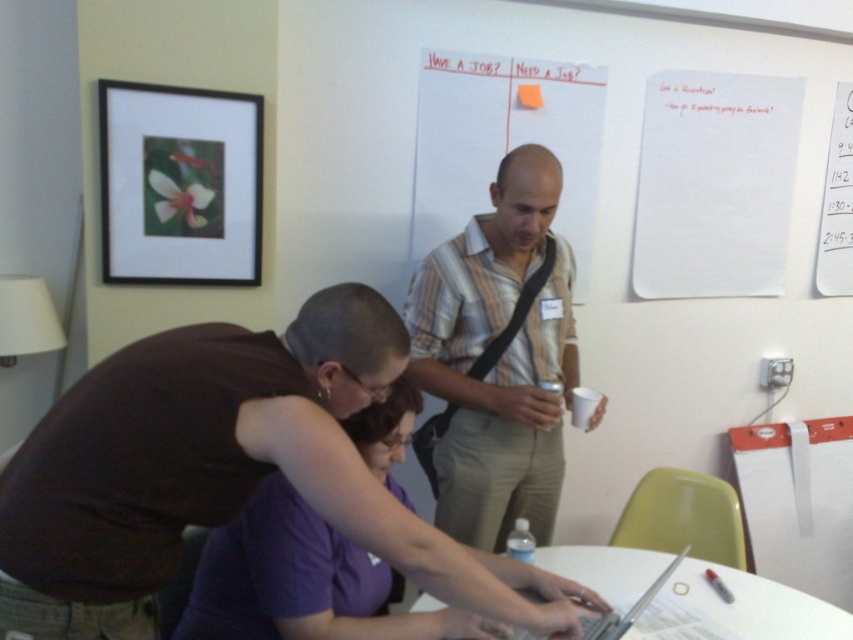
Question: Which of the following is the closest to the observer?

Choices:
 (A) (564, 272)
 (B) (625, 614)
 (C) (170, 106)

Answer: (B)

Question: Among these objects, which one is farthest from the camera?

Choices:
 (A) purple matte shirt at center
 (B) silver metallic laptop at center
 (C) striped cotton shirt at center

Answer: (C)

Question: Does purple matte shirt at center have a smaller size compared to silver metallic laptop at center?

Choices:
 (A) no
 (B) yes

Answer: (A)

Question: Which of the following is the farthest from the observer?

Choices:
 (A) striped cotton shirt at center
 (B) white glossy table at center
 (C) silver metallic laptop at center

Answer: (A)

Question: Can you confirm if striped cotton shirt at center is positioned to the right of black matte picture frame at upper left?

Choices:
 (A) yes
 (B) no

Answer: (A)

Question: Does purple matte shirt at center have a lesser width compared to silver metallic laptop at center?

Choices:
 (A) no
 (B) yes

Answer: (A)